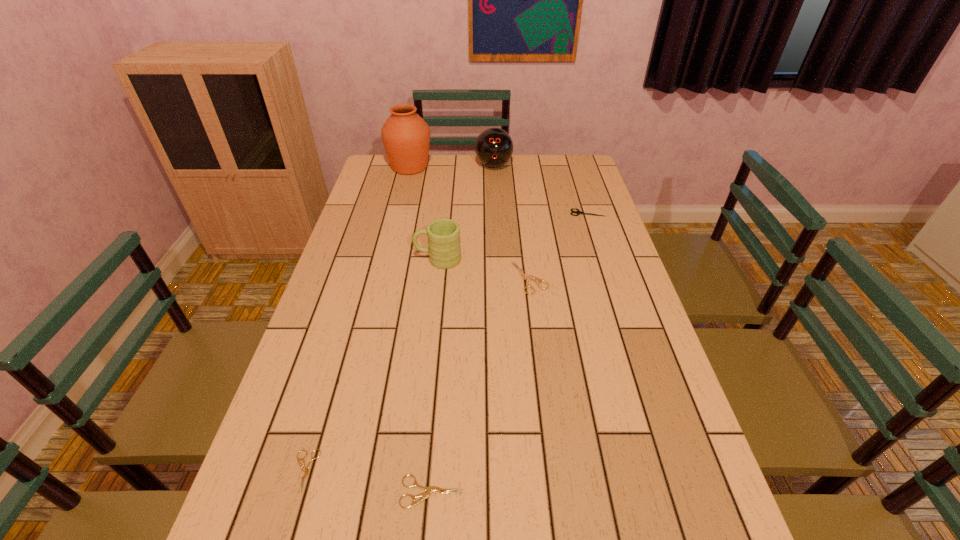
The height and width of the screenshot is (540, 960). Find the location of `vacant position located 0.120m on the left of the rightmost beige shears`. vacant position located 0.120m on the left of the rightmost beige shears is located at coordinates (471, 278).

Where is `free space located 0.310m on the right of the third tallest shears`? The height and width of the screenshot is (540, 960). free space located 0.310m on the right of the third tallest shears is located at coordinates (624, 492).

Find the location of a particular element. This screenshot has height=540, width=960. vacant space located on the right of the shortest object is located at coordinates (477, 471).

Find the location of a particular element. This screenshot has height=540, width=960. urn that is at the far edge is located at coordinates (406, 136).

Identify the location of bowling ball positioned at the far edge. (494, 147).

I want to click on urn located in the left edge section of the desktop, so click(406, 136).

Where is `shears that is at the left edge`? The height and width of the screenshot is (540, 960). shears that is at the left edge is located at coordinates (306, 469).

Identify the location of object positioned at the right edge. [578, 212].

Locate an element on the screen. This screenshot has height=540, width=960. object located in the far left corner section of the desktop is located at coordinates (406, 136).

Locate an element on the screen. The width and height of the screenshot is (960, 540). free space at the far edge of the desktop is located at coordinates (480, 182).